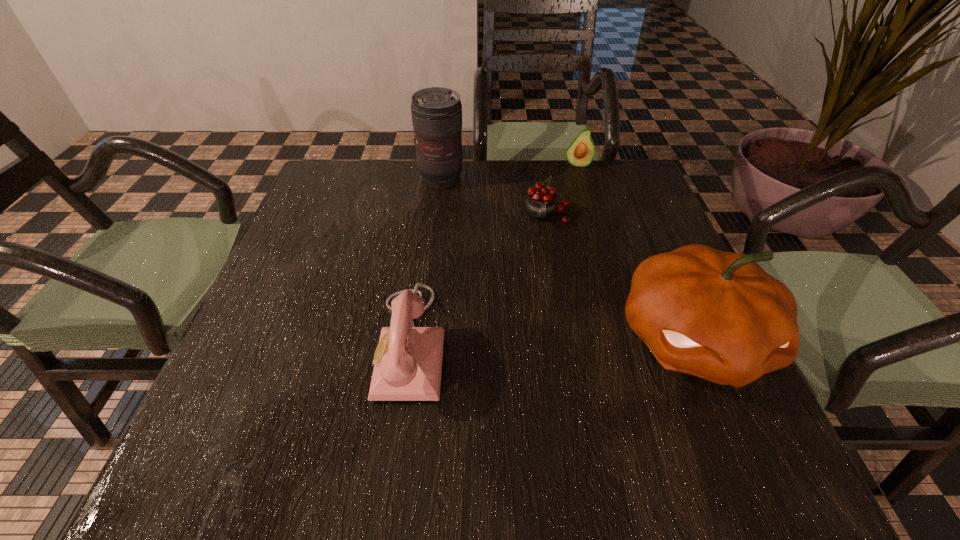
Locate an element on the screen. This screenshot has height=540, width=960. empty location between the pumpkin and the third shortest object is located at coordinates (552, 341).

This screenshot has height=540, width=960. I want to click on free space between the avocado and the telephoto lens, so click(509, 172).

This screenshot has width=960, height=540. Find the location of `free space between the avocado and the telephoto lens`. free space between the avocado and the telephoto lens is located at coordinates (509, 172).

You are a GUI agent. You are given a task and a screenshot of the screen. Output one action in this format:
    pyautogui.click(x=<x>, y=<y>)
    Task: Click on the second closest object relative to the avocado
    
    Given the screenshot: What is the action you would take?
    pyautogui.click(x=436, y=112)

The height and width of the screenshot is (540, 960). In order to click on object that can be found as the closest to the third shortest object in this screenshot , I will do `click(540, 204)`.